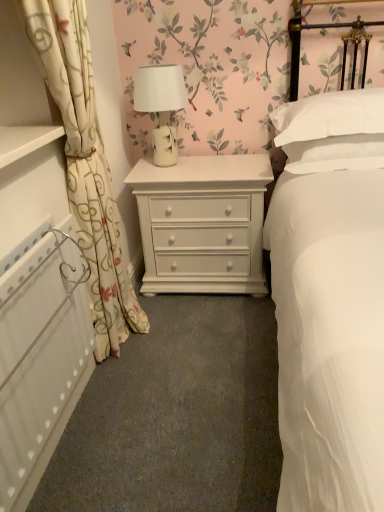
Question: Does white smooth bed at center lie behind white painted wood chest of drawers at center?

Choices:
 (A) no
 (B) yes

Answer: (A)

Question: From a real-world perspective, does white smooth bed at center sit lower than white painted wood chest of drawers at center?

Choices:
 (A) yes
 (B) no

Answer: (B)

Question: Is white smooth bed at center wider than white painted wood chest of drawers at center?

Choices:
 (A) no
 (B) yes

Answer: (B)

Question: From a real-world perspective, is white smooth bed at center on top of white painted wood chest of drawers at center?

Choices:
 (A) yes
 (B) no

Answer: (A)

Question: Is white smooth bed at center turned away from white painted wood chest of drawers at center?

Choices:
 (A) no
 (B) yes

Answer: (A)

Question: Does white smooth bed at center have a smaller size compared to white painted wood chest of drawers at center?

Choices:
 (A) yes
 (B) no

Answer: (B)

Question: Is white floral fabric curtain at left to the left of white smooth bed at center from the viewer's perspective?

Choices:
 (A) no
 (B) yes

Answer: (B)

Question: Is white smooth bed at center surrounded by white floral fabric curtain at left?

Choices:
 (A) yes
 (B) no

Answer: (B)

Question: From the image's perspective, is white floral fabric curtain at left below white smooth bed at center?

Choices:
 (A) yes
 (B) no

Answer: (B)

Question: Is white floral fabric curtain at left facing away from white smooth bed at center?

Choices:
 (A) yes
 (B) no

Answer: (B)

Question: Does white floral fabric curtain at left have a smaller size compared to white smooth bed at center?

Choices:
 (A) no
 (B) yes

Answer: (B)

Question: Is white floral fabric curtain at left aimed at white smooth bed at center?

Choices:
 (A) yes
 (B) no

Answer: (A)

Question: Is white soft pillow at upper right smaller than white textured radiator at left?

Choices:
 (A) no
 (B) yes

Answer: (A)